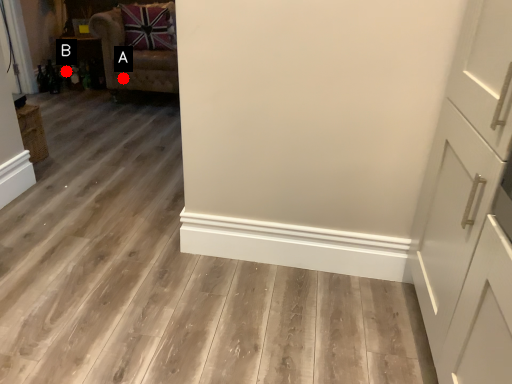
Question: Two points are circled on the image, labeled by A and B beside each circle. Among these points, which one is nearest to the camera?

Choices:
 (A) A is closer
 (B) B is closer

Answer: (A)